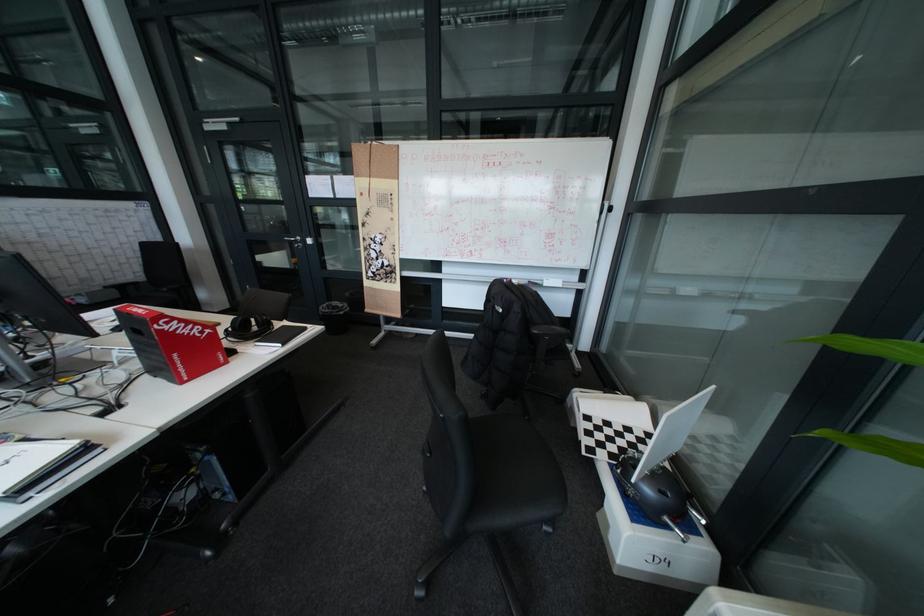
This screenshot has height=616, width=924. What are the coordinates of `black chair sitting surface` in the screenshot? It's located at (514, 462).